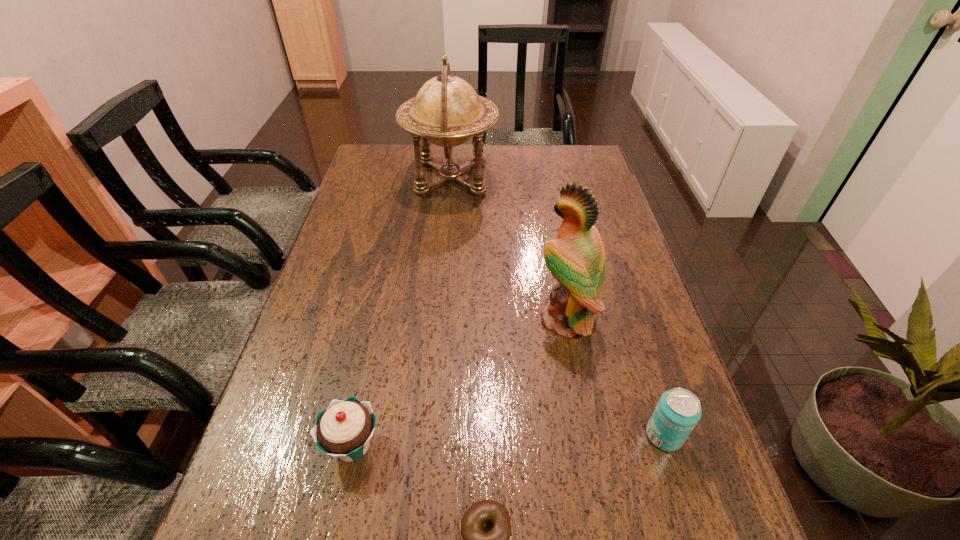
Where is `free area in between the parrot and the cupcake`? Image resolution: width=960 pixels, height=540 pixels. free area in between the parrot and the cupcake is located at coordinates click(x=459, y=382).

Identify the location of empty space between the cupcake and the beer can. (508, 440).

You are a GUI agent. You are given a task and a screenshot of the screen. Output one action in this format:
    pyautogui.click(x=<x>, y=<y>)
    Task: Click on the free space between the cupcake and the rightmost object
    The height and width of the screenshot is (540, 960).
    Given the screenshot: What is the action you would take?
    pyautogui.click(x=508, y=440)

This screenshot has height=540, width=960. I want to click on vacant point located between the cupcake and the rightmost object, so click(x=508, y=440).

You are a GUI agent. You are given a task and a screenshot of the screen. Output one action in this format:
    pyautogui.click(x=<x>, y=<y>)
    Task: Click on the free space between the cupcake and the beer can
    
    Given the screenshot: What is the action you would take?
    pyautogui.click(x=508, y=440)

I want to click on object that is the second closest to the globe, so click(344, 429).

Locate an element on the screen. The image size is (960, 540). the third closest object to the globe is located at coordinates (678, 411).